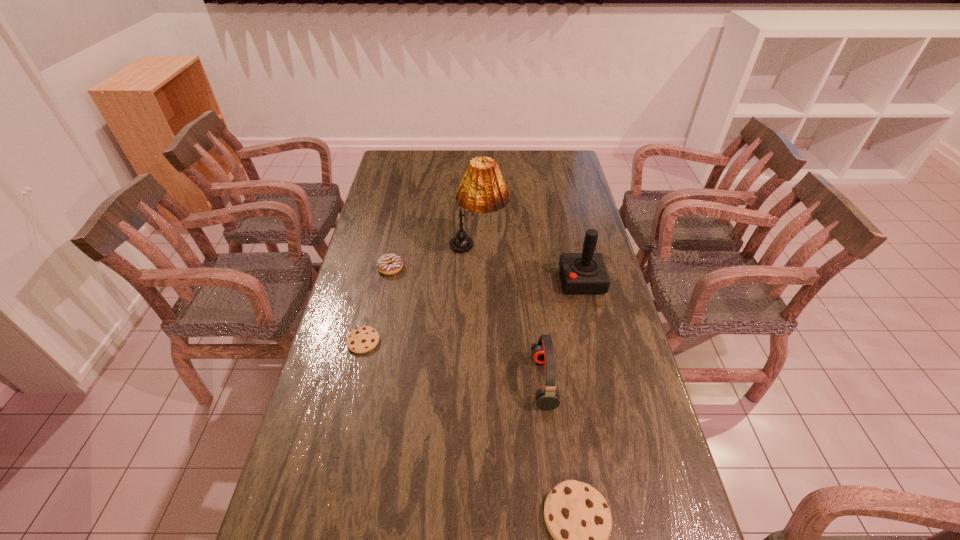
Identify the location of the fourth closest object to the second tallest object. (360, 340).

Where is `the second closest object to the right cookie`? This screenshot has height=540, width=960. the second closest object to the right cookie is located at coordinates (360, 340).

Image resolution: width=960 pixels, height=540 pixels. I want to click on vacant space that satisfies the following two spatial constraints: 1. on the front-facing side of the lampshade; 2. on the front side of the farther cookie, so click(x=478, y=341).